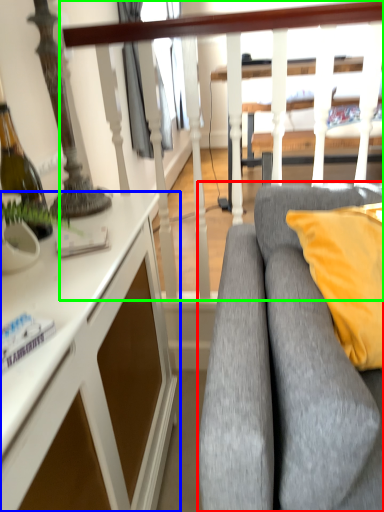
Question: Which object is positioned farthest from studio couch (highlighted by a red box)? Select from desk (highlighted by a blue box) and rail (highlighted by a green box).

Choices:
 (A) desk
 (B) rail

Answer: (B)